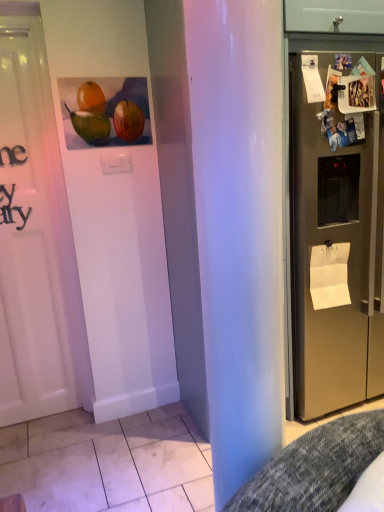
Measure the distance between matte acrylic painting of fruits at upper left and camera.

The distance of matte acrylic painting of fruits at upper left from camera is 1.88 meters.

Image resolution: width=384 pixels, height=512 pixels. What do you see at coordinates (329, 275) in the screenshot?
I see `white paper at right, which is the second paper in top-to-bottom order` at bounding box center [329, 275].

You are a GUI agent. You are given a task and a screenshot of the screen. Output one action in this format:
    pyautogui.click(x=<x>, y=<y>)
    Task: Click on the white paper at right, the first paper from the bottom
    The height and width of the screenshot is (512, 384).
    Given the screenshot: What is the action you would take?
    pyautogui.click(x=329, y=275)

Identify the location of satin silver refrigerator at right. This screenshot has width=384, height=512. (336, 236).

Locate an element on the screen. This screenshot has width=384, height=512. matte acrylic painting of fruits at upper left is located at coordinates (106, 112).

From the picture: Considering the relative sizes of white paper at right, the 1th paper viewed from the right, and matte acrylic painting of fruits at upper left in the image provided, is white paper at right, the 1th paper viewed from the right, thinner than matte acrylic painting of fruits at upper left?

No, white paper at right, the 1th paper viewed from the right, is not thinner than matte acrylic painting of fruits at upper left.

In the image, is white paper at right, the first paper from the bottom, positioned in front of or behind matte acrylic painting of fruits at upper left?

Clearly, white paper at right, the first paper from the bottom, is behind matte acrylic painting of fruits at upper left.

Which is in front, point (347, 247) or point (142, 83)?

The point (347, 247) is in front.

Is matte acrylic painting of fruits at upper left smaller than satin silver refrigerator at right?

Yes.

Can you confirm if matte acrylic painting of fruits at upper left is thinner than satin silver refrigerator at right?

Correct, the width of matte acrylic painting of fruits at upper left is less than that of satin silver refrigerator at right.

Is matte acrylic painting of fruits at upper left at the right side of satin silver refrigerator at right?

No, matte acrylic painting of fruits at upper left is not to the right of satin silver refrigerator at right.

Based on the photo, is matte acrylic painting of fruits at upper left shorter than satin silver refrigerator at right?

Yes, matte acrylic painting of fruits at upper left is shorter than satin silver refrigerator at right.

Considering the relative sizes of satin silver refrigerator at right and white paper at right, the 1th paper viewed from the right, in the image provided, is satin silver refrigerator at right smaller than white paper at right, the 1th paper viewed from the right,?

Actually, satin silver refrigerator at right might be larger than white paper at right, the 1th paper viewed from the right.

From a real-world perspective, which object stands above the other?

satin silver refrigerator at right.

Considering the relative positions of satin silver refrigerator at right and white paper at right, the first paper from the bottom, in the image provided, is satin silver refrigerator at right to the right of white paper at right, the first paper from the bottom, from the viewer's perspective?

Yes, satin silver refrigerator at right is to the right of white paper at right, the first paper from the bottom.

Measure the distance between satin silver refrigerator at right and white paper at right, which is the second paper in top-to-bottom order.

satin silver refrigerator at right and white paper at right, which is the second paper in top-to-bottom order, are 8.13 inches apart.

Can you confirm if white paper at right, which is the second paper in top-to-bottom order, is shorter than white paper at upper right, which is counted as the 1th paper, starting from the left?

No.

Consider the image. From a real-world perspective, who is located lower, white paper at right, the first paper viewed from the back, or white paper at upper right, positioned as the first paper in front-to-back order?

white paper at right, the first paper viewed from the back, is physically lower.

Between point (310, 273) and point (318, 78), which one is positioned behind?

The point (310, 273) is more distant.

Are satin silver refrigerator at right and white paper at upper right, which is counted as the 1th paper, starting from the left, located far from each other?

satin silver refrigerator at right is actually quite close to white paper at upper right, which is counted as the 1th paper, starting from the left.

Is the position of satin silver refrigerator at right more distant than that of white paper at upper right, marked as the 2th paper in a back-to-front arrangement?

No.

Is point (317, 173) closer to camera compared to point (308, 76)?

No, (317, 173) is behind (308, 76).

Does satin silver refrigerator at right turn towards white paper at upper right, which appears as the 2th paper when viewed from the right?

Yes, satin silver refrigerator at right is oriented towards white paper at upper right, which appears as the 2th paper when viewed from the right.

From the image's perspective, is satin silver refrigerator at right on top of matte acrylic painting of fruits at upper left?

No, from the image's perspective, satin silver refrigerator at right is not on top of matte acrylic painting of fruits at upper left.

Is satin silver refrigerator at right smaller than matte acrylic painting of fruits at upper left?

No.

Looking at their sizes, would you say satin silver refrigerator at right is wider or thinner than matte acrylic painting of fruits at upper left?

Considering their sizes, satin silver refrigerator at right looks broader than matte acrylic painting of fruits at upper left.

From a real-world perspective, is satin silver refrigerator at right located beneath matte acrylic painting of fruits at upper left?

Yes.

Is white paper at upper right, which is counted as the 1th paper, starting from the left, to the right of white paper at right, the 2th paper viewed from the left, from the viewer's perspective?

Incorrect, white paper at upper right, which is counted as the 1th paper, starting from the left, is not on the right side of white paper at right, the 2th paper viewed from the left.

This screenshot has height=512, width=384. Find the location of `paper lying behind the white paper at upper right, which appears as the 2th paper when viewed from the right`. paper lying behind the white paper at upper right, which appears as the 2th paper when viewed from the right is located at coordinates (329, 275).

How different are the orientations of white paper at upper right, positioned as the 2th paper in bottom-to-top order, and white paper at right, the first paper viewed from the back, in degrees?

There is a 0.00788-degree angle between the facing directions of white paper at upper right, positioned as the 2th paper in bottom-to-top order, and white paper at right, the first paper viewed from the back.

Looking at this image, does white paper at upper right, positioned as the 2th paper in bottom-to-top order, have a greater height compared to white paper at right, the first paper viewed from the back?

In fact, white paper at upper right, positioned as the 2th paper in bottom-to-top order, may be shorter than white paper at right, the first paper viewed from the back.

Locate an element on the screen. The image size is (384, 512). fruit that is on the left side of white paper at right, the 2th paper viewed from the left is located at coordinates (106, 112).

In the image, there is a satin silver refrigerator at right. Where is `fruit above it (from the image's perspective)`? Image resolution: width=384 pixels, height=512 pixels. fruit above it (from the image's perspective) is located at coordinates (106, 112).

Looking at the image, which one is located closer to satin silver refrigerator at right, white paper at upper right, which appears as the 2th paper when viewed from the right, or matte acrylic painting of fruits at upper left?

white paper at upper right, which appears as the 2th paper when viewed from the right, is positioned closer to the anchor satin silver refrigerator at right.

Considering their positions, is satin silver refrigerator at right positioned closer to white paper at right, which is the second paper in top-to-bottom order, than matte acrylic painting of fruits at upper left?

satin silver refrigerator at right lies closer to white paper at right, which is the second paper in top-to-bottom order, than the other object.

Which object lies further to the anchor point white paper at upper right, which is counted as the 1th paper, starting from the left, satin silver refrigerator at right or matte acrylic painting of fruits at upper left?

matte acrylic painting of fruits at upper left.

From the image, which object appears to be nearer to satin silver refrigerator at right, white paper at upper right, which is counted as the 1th paper, starting from the left, or white paper at right, the 2th paper viewed from the left?

white paper at right, the 2th paper viewed from the left, is positioned closer to the anchor satin silver refrigerator at right.

Estimate the real-world distances between objects in this image. Which object is further from white paper at upper right, which is counted as the 1th paper, starting from the left, satin silver refrigerator at right or white paper at right, the 1th paper viewed from the right?

white paper at right, the 1th paper viewed from the right.

From the image, which object appears to be farther from white paper at right, the 2th paper viewed from the left, matte acrylic painting of fruits at upper left or white paper at upper right, the 1th paper when ordered from top to bottom?

matte acrylic painting of fruits at upper left lies further to white paper at right, the 2th paper viewed from the left, than the other object.

Looking at the image, which one is located further to satin silver refrigerator at right, white paper at right, the 1th paper viewed from the right, or white paper at upper right, positioned as the 2th paper in bottom-to-top order?

white paper at upper right, positioned as the 2th paper in bottom-to-top order.

Considering their positions, is white paper at upper right, which appears as the 2th paper when viewed from the right, positioned closer to matte acrylic painting of fruits at upper left than white paper at right, the first paper viewed from the back?

The object closer to matte acrylic painting of fruits at upper left is white paper at upper right, which appears as the 2th paper when viewed from the right.

Find the location of `refrigerator between white paper at upper right, the 1th paper when ordered from top to bottom, and white paper at right, which is the second paper in top-to-bottom order, in the up-down direction`. refrigerator between white paper at upper right, the 1th paper when ordered from top to bottom, and white paper at right, which is the second paper in top-to-bottom order, in the up-down direction is located at coordinates (336, 236).

Identify the location of paper situated between matte acrylic painting of fruits at upper left and white paper at right, which is the second paper in top-to-bottom order, from left to right. The width and height of the screenshot is (384, 512). (312, 79).